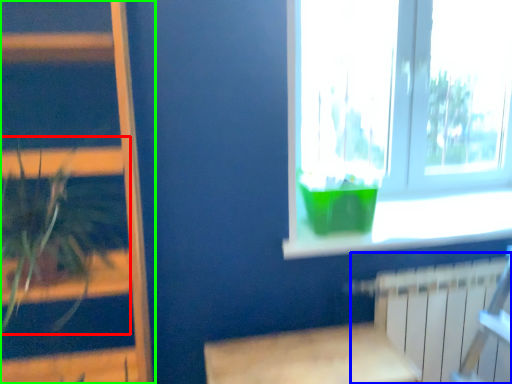
Question: Considering the real-world distances, which object is farthest from houseplant (highlighted by a red box)? radiator (highlighted by a blue box) or bookshelf (highlighted by a green box)?

Choices:
 (A) radiator
 (B) bookshelf

Answer: (A)